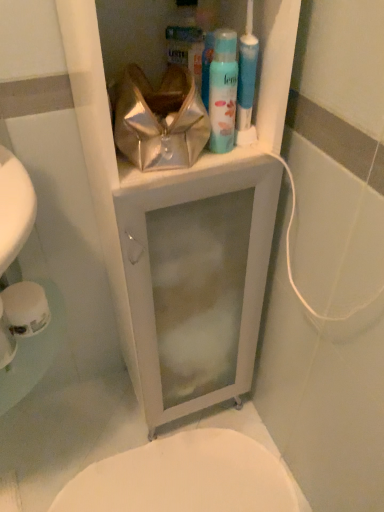
Question: Is metallic gold pouch at upper center bigger or smaller than light blue matte shaving cream at upper center?

Choices:
 (A) big
 (B) small

Answer: (A)

Question: Is metallic gold pouch at upper center inside the boundaries of light blue matte shaving cream at upper center, or outside?

Choices:
 (A) inside
 (B) outside

Answer: (B)

Question: Which object is positioned farthest from the white matte toilet paper at lower left?

Choices:
 (A) white glossy bidet at lower center
 (B) metallic gold pouch at upper center
 (C) light blue matte shaving cream at upper center
 (D) white glossy medicine cabinet at upper center

Answer: (A)

Question: Estimate the real-world distances between objects in this image. Which object is closer to the white glossy bidet at lower center?

Choices:
 (A) white matte toilet paper at lower left
 (B) metallic gold pouch at upper center
 (C) white glossy medicine cabinet at upper center
 (D) light blue matte shaving cream at upper center

Answer: (C)